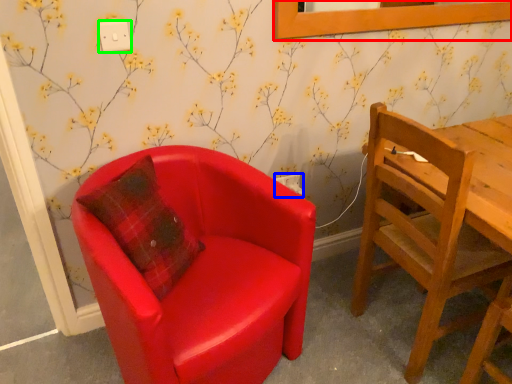
Question: Which object is the closest to the picture frame (highlighted by a red box)? Choose among these: power outlet (highlighted by a blue box) or power outlet (highlighted by a green box).

Choices:
 (A) power outlet
 (B) power outlet

Answer: (A)